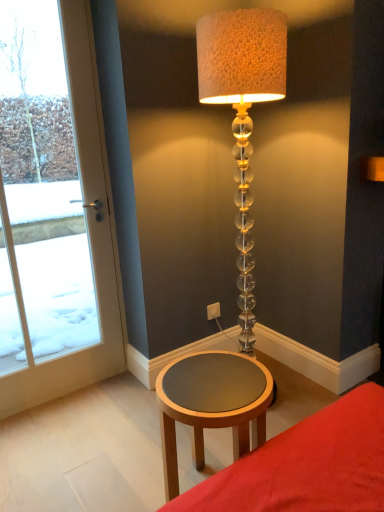
Question: Should I look upward or downward to see wooden round table at lower center?

Choices:
 (A) up
 (B) down

Answer: (B)

Question: Is wooden round table at lower center at the back of matte brown table at lower center?

Choices:
 (A) yes
 (B) no

Answer: (B)

Question: Can you confirm if matte brown table at lower center is bigger than wooden round table at lower center?

Choices:
 (A) yes
 (B) no

Answer: (A)

Question: Is wooden round table at lower center completely or partially inside matte brown table at lower center?

Choices:
 (A) yes
 (B) no

Answer: (B)

Question: Does matte brown table at lower center have a greater width compared to wooden round table at lower center?

Choices:
 (A) yes
 (B) no

Answer: (A)

Question: Does matte brown table at lower center have a lesser height compared to wooden round table at lower center?

Choices:
 (A) yes
 (B) no

Answer: (A)

Question: From the image's perspective, does matte brown table at lower center appear lower than wooden round table at lower center?

Choices:
 (A) no
 (B) yes

Answer: (B)

Question: Can you confirm if white plastic electric outlet at lower center is thinner than wooden round table at lower center?

Choices:
 (A) yes
 (B) no

Answer: (A)

Question: Does white plastic electric outlet at lower center appear on the left side of wooden round table at lower center?

Choices:
 (A) yes
 (B) no

Answer: (B)

Question: Is white plastic electric outlet at lower center bigger than wooden round table at lower center?

Choices:
 (A) yes
 (B) no

Answer: (B)

Question: From the image's perspective, is white plastic electric outlet at lower center below wooden round table at lower center?

Choices:
 (A) no
 (B) yes

Answer: (A)

Question: Is white plastic electric outlet at lower center facing towards wooden round table at lower center?

Choices:
 (A) no
 (B) yes

Answer: (A)

Question: Would you consider white plastic electric outlet at lower center to be distant from wooden round table at lower center?

Choices:
 (A) no
 (B) yes

Answer: (A)

Question: Could you tell me if white glass door at left is facing white plastic electric outlet at lower center?

Choices:
 (A) no
 (B) yes

Answer: (A)